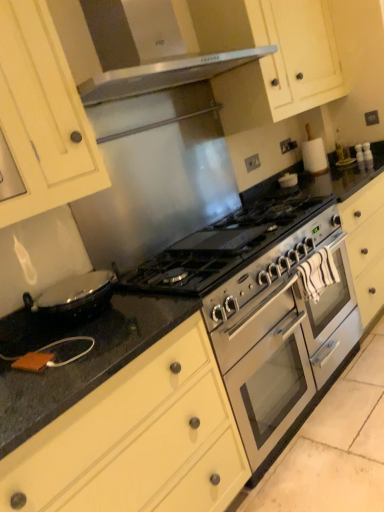
Question: From the image's perspective, is stainless steel oven at center under matte white cabinet at upper left, the 2th cabinetry from the bottom?

Choices:
 (A) no
 (B) yes

Answer: (B)

Question: Is stainless steel oven at center positioned with its back to matte white cabinet at upper left, the 2th cabinetry from the bottom?

Choices:
 (A) yes
 (B) no

Answer: (B)

Question: Does stainless steel oven at center have a greater width compared to matte white cabinet at upper left, positioned as the 2th cabinetry in top-to-bottom order?

Choices:
 (A) yes
 (B) no

Answer: (A)

Question: Are stainless steel oven at center and matte white cabinet at upper left, the 2th cabinetry from the bottom, far apart?

Choices:
 (A) no
 (B) yes

Answer: (A)

Question: Considering the relative positions of stainless steel oven at center and matte white cabinet at upper left, positioned as the 2th cabinetry in top-to-bottom order, in the image provided, is stainless steel oven at center to the right of matte white cabinet at upper left, positioned as the 2th cabinetry in top-to-bottom order, from the viewer's perspective?

Choices:
 (A) no
 (B) yes

Answer: (B)

Question: From the image's perspective, would you say stainless steel oven at center is positioned over matte white cabinet at upper left, the 2th cabinetry from the bottom?

Choices:
 (A) no
 (B) yes

Answer: (A)

Question: Is matte cream cabinet at upper center, placed as the third cabinetry when sorted from bottom to top, at the left side of stainless steel gas stove at center?

Choices:
 (A) no
 (B) yes

Answer: (A)

Question: Considering the relative sizes of matte cream cabinet at upper center, acting as the 1th cabinetry starting from the top, and stainless steel gas stove at center in the image provided, is matte cream cabinet at upper center, acting as the 1th cabinetry starting from the top, bigger than stainless steel gas stove at center?

Choices:
 (A) no
 (B) yes

Answer: (B)

Question: Does matte cream cabinet at upper center, placed as the third cabinetry when sorted from bottom to top, have a greater width compared to stainless steel gas stove at center?

Choices:
 (A) no
 (B) yes

Answer: (A)

Question: Does matte cream cabinet at upper center, placed as the third cabinetry when sorted from bottom to top, appear on the right side of stainless steel gas stove at center?

Choices:
 (A) yes
 (B) no

Answer: (A)

Question: From the image's perspective, is matte cream cabinet at upper center, placed as the third cabinetry when sorted from bottom to top, above stainless steel gas stove at center?

Choices:
 (A) no
 (B) yes

Answer: (B)

Question: Is matte cream cabinet at upper center, acting as the 1th cabinetry starting from the top, outside of stainless steel gas stove at center?

Choices:
 (A) yes
 (B) no

Answer: (A)

Question: Can you confirm if stainless steel gas stove at center is taller than matte white cabinet at upper left, positioned as the 2th cabinetry in top-to-bottom order?

Choices:
 (A) no
 (B) yes

Answer: (A)